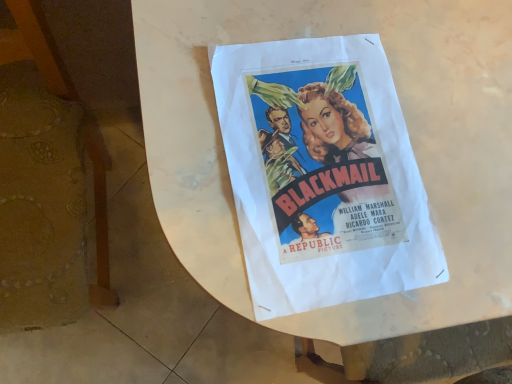
Locate an element on the screen. The width and height of the screenshot is (512, 384). vacant space that is to the left of matte paper poster at center is located at coordinates (195, 81).